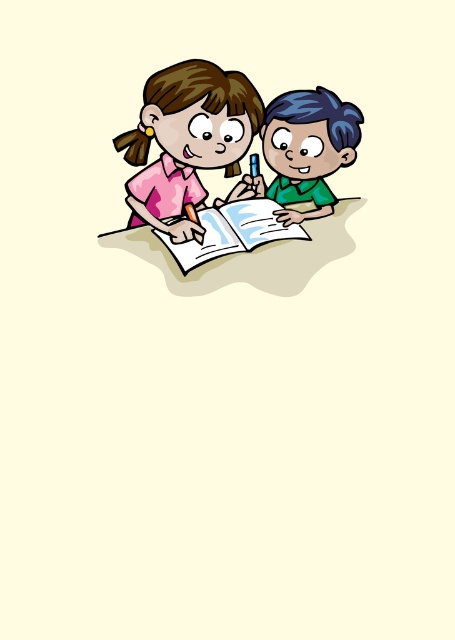
You are a character in the image and want to place a sticker exactly where the matte pink shirt at upper left is located. What are the coordinates of the point where you should place the sticker?

The coordinates for the matte pink shirt at upper left are at point [186,141].